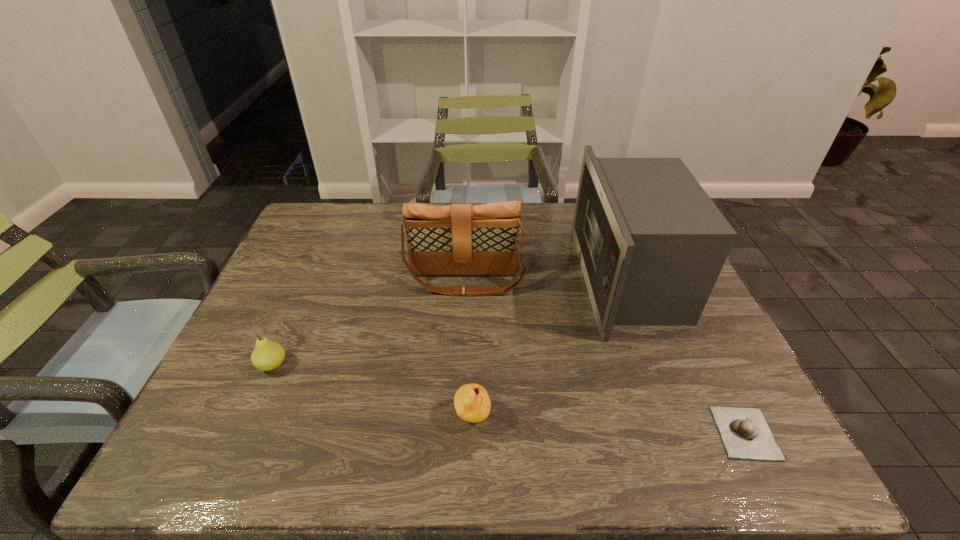
You are a GUI agent. You are given a task and a screenshot of the screen. Output one action in this format:
    pyautogui.click(x=<x>, y=<y>)
    Task: Click on the empty space that is in between the shortest object and the third farthest object
    
    Given the screenshot: What is the action you would take?
    pyautogui.click(x=509, y=399)

Locate an element on the screen. This screenshot has height=540, width=960. vacant space that is in between the shortest object and the right pear is located at coordinates (609, 424).

Where is `free space between the nearer pear and the shortest object`? Image resolution: width=960 pixels, height=540 pixels. free space between the nearer pear and the shortest object is located at coordinates (609, 424).

Locate an element on the screen. Image resolution: width=960 pixels, height=540 pixels. free space between the left pear and the tallest object is located at coordinates (450, 322).

Locate an element on the screen. The image size is (960, 540). vacant region between the leftmost object and the microwave oven is located at coordinates (450, 322).

Image resolution: width=960 pixels, height=540 pixels. I want to click on free point between the fourth shortest object and the tallest object, so click(546, 279).

Locate an element on the screen. The height and width of the screenshot is (540, 960). the fourth closest object relative to the leftmost object is located at coordinates (745, 434).

Image resolution: width=960 pixels, height=540 pixels. I want to click on object that is the second closest to the tallest object, so click(745, 434).

In order to click on vacant area in the image that satisfies the following two spatial constraints: 1. on the front-facing side of the tallest object; 2. on the right side of the garlic in this screenshot , I will do `click(686, 433)`.

You are a GUI agent. You are given a task and a screenshot of the screen. Output one action in this format:
    pyautogui.click(x=<x>, y=<y>)
    Task: Click on the vacant area that satisfies the following two spatial constraints: 1. on the front-facing side of the microwave oven; 2. on the front-facing side of the shoulder bag
    The height and width of the screenshot is (540, 960).
    Given the screenshot: What is the action you would take?
    pyautogui.click(x=628, y=280)